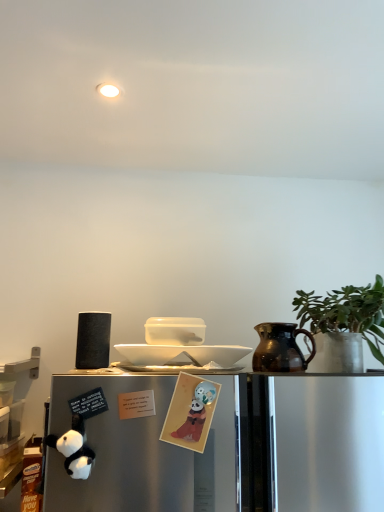
Question: In terms of size, does matte paper card at center, which appears as the first toy when viewed from the right, appear bigger or smaller than white glossy plate at center?

Choices:
 (A) small
 (B) big

Answer: (A)

Question: From their relative heights in the image, would you say matte paper card at center, which is the 2th toy from left to right, is taller or shorter than white glossy plate at center?

Choices:
 (A) short
 (B) tall

Answer: (B)

Question: Which object is positioned farthest from the white glossy plate at center?

Choices:
 (A) matte black speaker at left
 (B) white plush panda at lower left, which is counted as the first toy, starting from the left
 (C) brown glazed jug at right
 (D) green matte plant at right
 (E) matte paper card at center, which is the 2th toy from left to right

Answer: (B)

Question: Considering the real-world distances, which object is farthest from the matte paper card at center, which appears as the first toy when viewed from the right?

Choices:
 (A) white plush panda at lower left, which is counted as the first toy, starting from the left
 (B) brown glazed jug at right
 (C) white glossy plate at center
 (D) green matte plant at right
 (E) matte black speaker at left

Answer: (D)